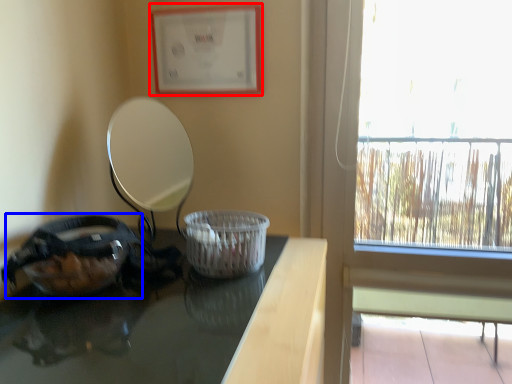
Question: Which object appears farthest to the camera in this image, picture frame (highlighted by a red box) or glass bowl (highlighted by a blue box)?

Choices:
 (A) picture frame
 (B) glass bowl

Answer: (A)